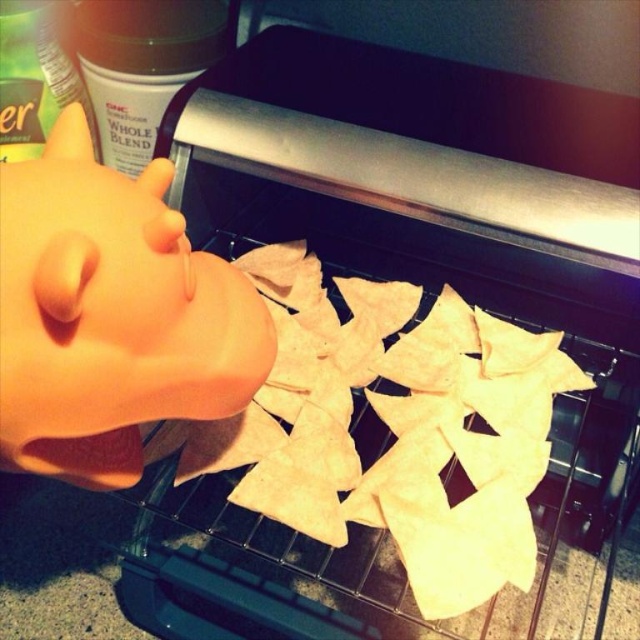
Who is shorter, light brown tortilla chips at center or matte plastic head at left?

With less height is matte plastic head at left.

Can you confirm if light brown tortilla chips at center is taller than matte plastic head at left?

Indeed, light brown tortilla chips at center has a greater height compared to matte plastic head at left.

This screenshot has height=640, width=640. Find the location of `light brown tortilla chips at center`. light brown tortilla chips at center is located at coordinates (392, 428).

Find the location of `light brown tortilla chips at center`. light brown tortilla chips at center is located at coordinates (392, 428).